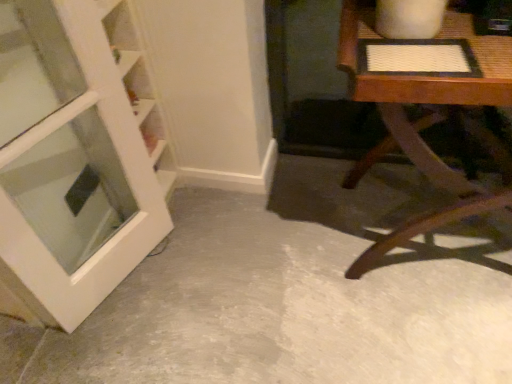
Question: Is white glossy door at left oriented towards wooden textured table at right?

Choices:
 (A) yes
 (B) no

Answer: (B)

Question: From the image's perspective, is white glossy door at left on wooden textured table at right?

Choices:
 (A) yes
 (B) no

Answer: (B)

Question: Considering the relative sizes of white glossy door at left and wooden textured table at right in the image provided, is white glossy door at left thinner than wooden textured table at right?

Choices:
 (A) yes
 (B) no

Answer: (A)

Question: Can you confirm if white glossy door at left is bigger than wooden textured table at right?

Choices:
 (A) yes
 (B) no

Answer: (B)

Question: Can you confirm if white glossy door at left is shorter than wooden textured table at right?

Choices:
 (A) no
 (B) yes

Answer: (A)

Question: From their relative heights in the image, would you say wooden textured table at right is taller or shorter than white glossy door at left?

Choices:
 (A) tall
 (B) short

Answer: (B)

Question: Is point (478, 192) positioned closer to the camera than point (73, 145)?

Choices:
 (A) closer
 (B) farther

Answer: (A)

Question: In terms of size, does wooden textured table at right appear bigger or smaller than white glossy door at left?

Choices:
 (A) big
 (B) small

Answer: (A)

Question: In terms of width, does wooden textured table at right look wider or thinner when compared to white glossy door at left?

Choices:
 (A) wide
 (B) thin

Answer: (A)

Question: In the image, is white glossy door at left on the left side or the right side of gray concrete floor at center?

Choices:
 (A) left
 (B) right

Answer: (A)

Question: In terms of height, does white glossy door at left look taller or shorter compared to gray concrete floor at center?

Choices:
 (A) short
 (B) tall

Answer: (B)

Question: Is white glossy door at left wider or thinner than gray concrete floor at center?

Choices:
 (A) wide
 (B) thin

Answer: (B)

Question: Is white glossy door at left inside the boundaries of gray concrete floor at center, or outside?

Choices:
 (A) inside
 (B) outside

Answer: (B)

Question: Visually, is white glossy door at left positioned to the left or to the right of wooden textured table at right?

Choices:
 (A) left
 (B) right

Answer: (A)

Question: Considering the positions of white glossy door at left and wooden textured table at right in the image, is white glossy door at left wider or thinner than wooden textured table at right?

Choices:
 (A) wide
 (B) thin

Answer: (B)